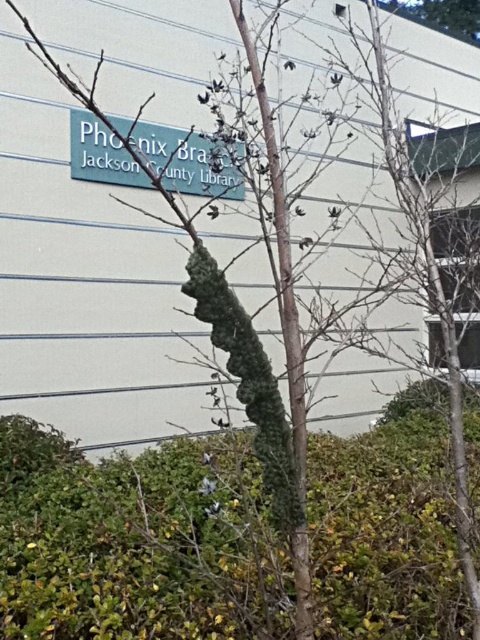
Question: Can you confirm if green leafy hedge at center is positioned to the left of teal matte sign at upper center?

Choices:
 (A) yes
 (B) no

Answer: (B)

Question: Which object appears closest to the camera in this image?

Choices:
 (A) green leafy hedge at center
 (B) teal matte sign at upper center

Answer: (A)

Question: Which point is farther from the camera taking this photo?

Choices:
 (A) (16, 538)
 (B) (159, 128)

Answer: (B)

Question: Considering the relative positions of green leafy hedge at center and teal matte sign at upper center in the image provided, where is green leafy hedge at center located with respect to teal matte sign at upper center?

Choices:
 (A) below
 (B) above

Answer: (A)

Question: Can you confirm if green leafy hedge at center is positioned below teal matte sign at upper center?

Choices:
 (A) no
 (B) yes

Answer: (B)

Question: Which point is farther from the camera taking this photo?

Choices:
 (A) (384, 460)
 (B) (168, 154)

Answer: (B)